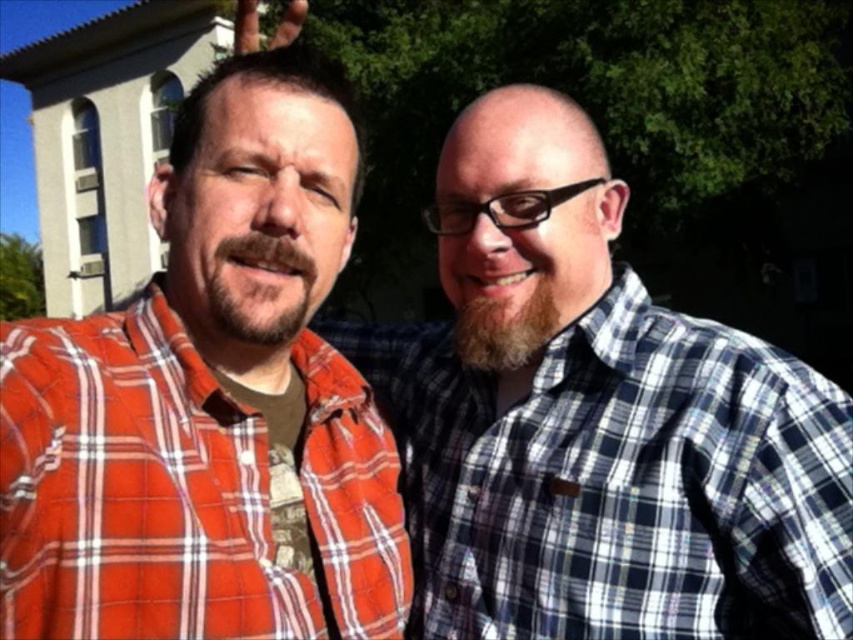
You are trying to locate the plaid shirt at center in the image. The coordinates given are point (x=596, y=420). Can you confirm if this point is located in the lower half of the image?

The point (x=596, y=420) corresponds to the plaid shirt at center. Since the y coordinate is 0.700, which is above 0.5, it is in the upper half of the image.

In the scene shown: You are trying to decide which plaid shirt to wear for a casual outing. The plaid shirt at center and the red plaid shirt at left are your options. Based on their sizes, which one is wider?

The plaid shirt at center is wider than the red plaid shirt at left according to the description.